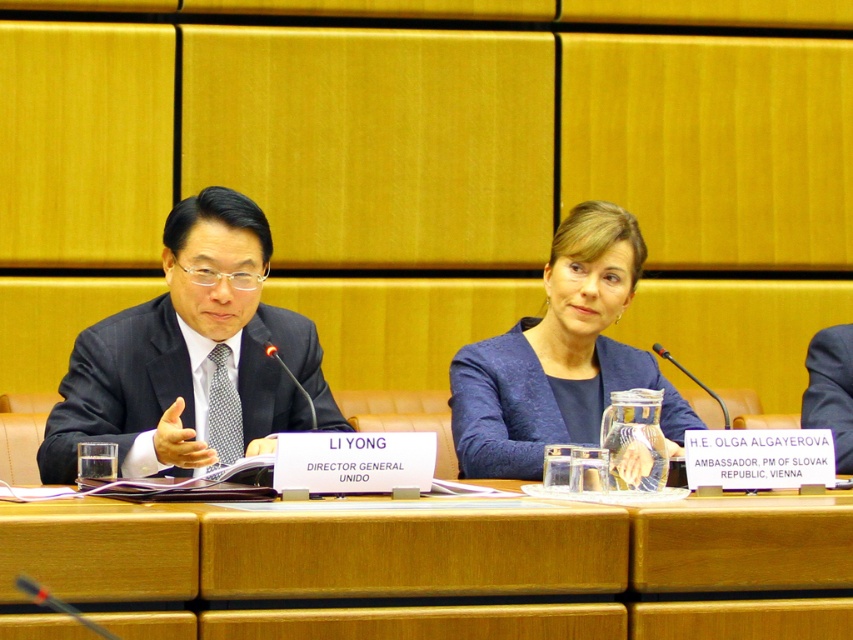
Looking at this image, you are a photographer positioned at the camera in the scene. You need to capture a closeup shot of the matte black suit at left without moving the camera. Is it possible to do so with the current setup?

The matte black suit at left and camera are 3.45 meters apart from each other. Since the photographer is at the camera and the distance is fixed, they can adjust the zoom lens to capture a closeup of the matte black suit at left without moving the camera.

Based on the photo, you are organizing a meeting and need to seat two people at the table. One will sit on the wooden at center and the other on the blue fabric business suit at center. Which seat has more space for personal items?

The wooden at center has a larger width than the blue fabric business suit at center, so it offers more space for personal items.